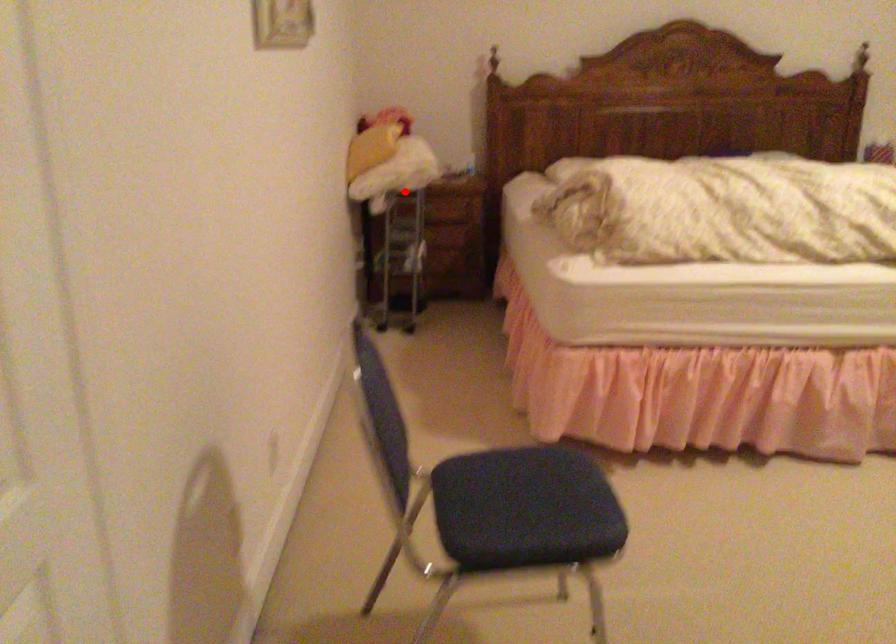
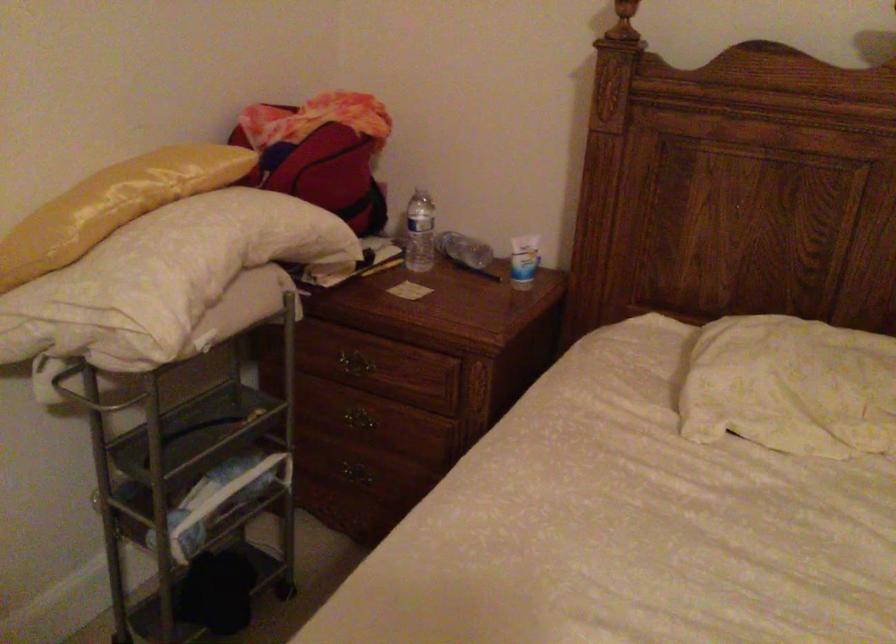
Question: I am providing you with two images of the same scene from different viewpoints. In image1, a red point is highlighted. Considering the same 3D point in image2, which of the following is correct?

Choices:
 (A) It is closer
 (B) It is farther

Answer: (A)